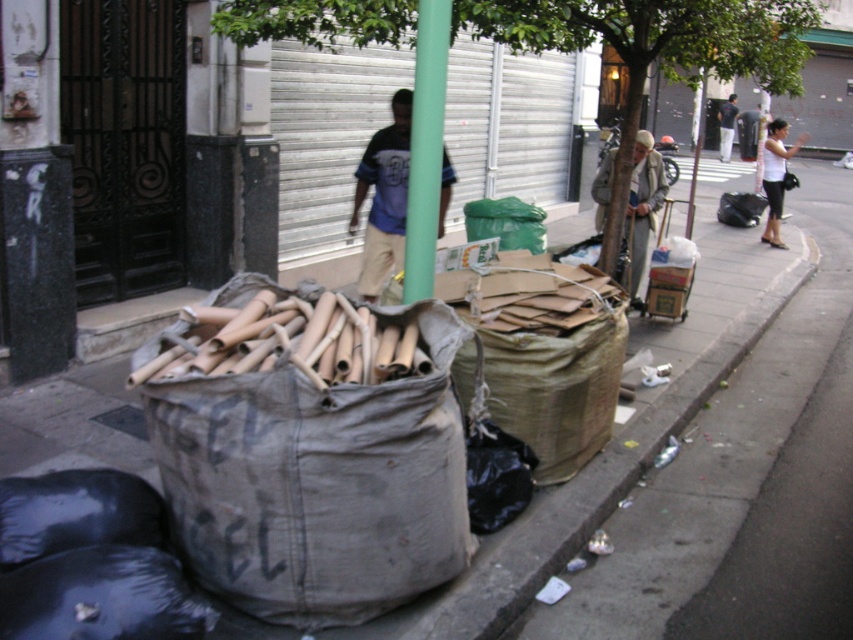
You are standing on the sidewalk and see both the green leafy tree at center and the gray woolen sweater at center. Which object is closer to you?

The green leafy tree at center is closer to you because it is in front of the gray woolen sweater at center.

You are standing in the urban street scene described. You want to take a photo of the gray woolen sweater at center without including the green leafy tree at center in the frame. Which direction should you move relative to the current position to achieve this?

Answer: Move to the right side of the gray woolen sweater at center so that the green leafy tree at center is no longer in the frame.

You are standing on the sidewalk and see the green plastic bag at center and the dark blue shirt at center. Which object is closer to your left side?

The green plastic bag at center is closer to your left side because it is positioned to the left of the dark blue shirt at center.